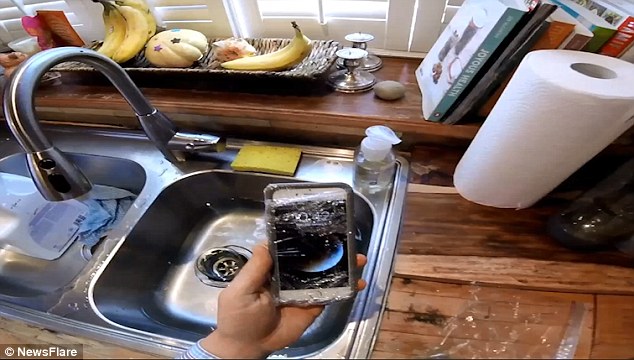
Locate an element on the screen. Image resolution: width=634 pixels, height=360 pixels. faucet is located at coordinates (158, 121).